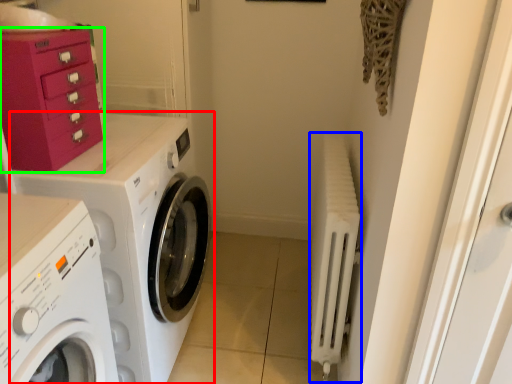
Question: Which object is positioned farthest from washing machine (highlighted by a red box)? Select from radiator (highlighted by a blue box) and cabinetry (highlighted by a green box).

Choices:
 (A) radiator
 (B) cabinetry

Answer: (A)